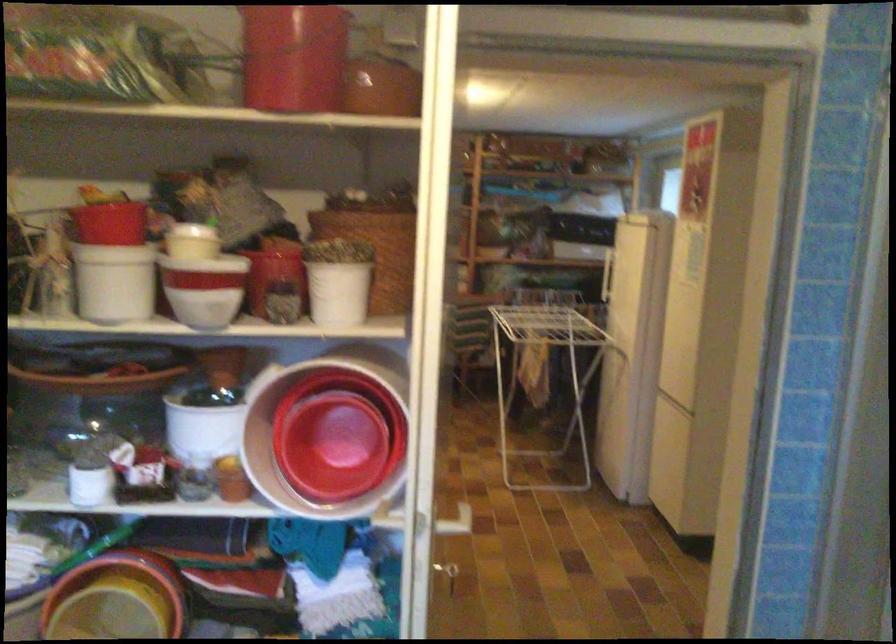
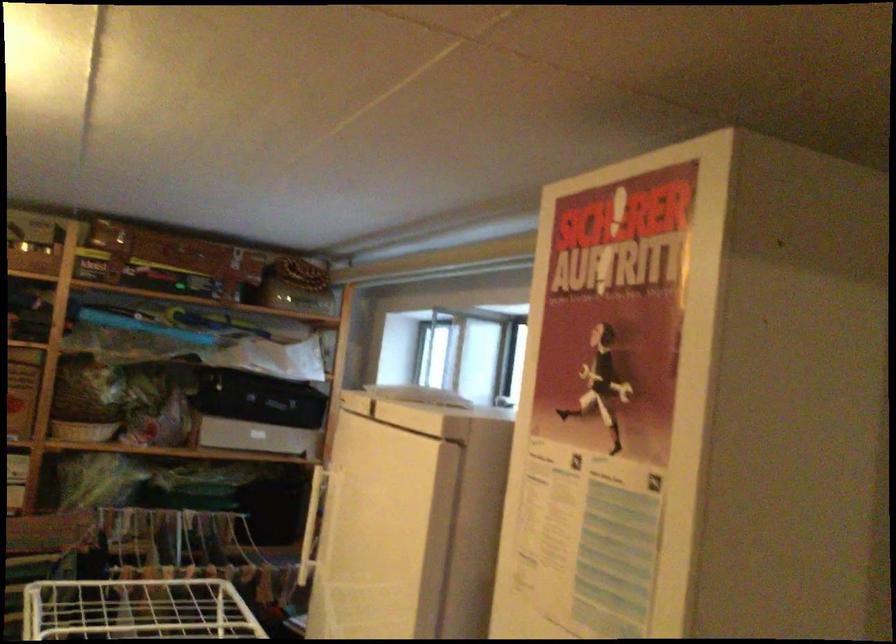
Question: In a continuous first-person perspective shot, in which direction is the camera moving?

Choices:
 (A) Left
 (B) Right
 (C) Forward
 (D) Backward

Answer: (C)